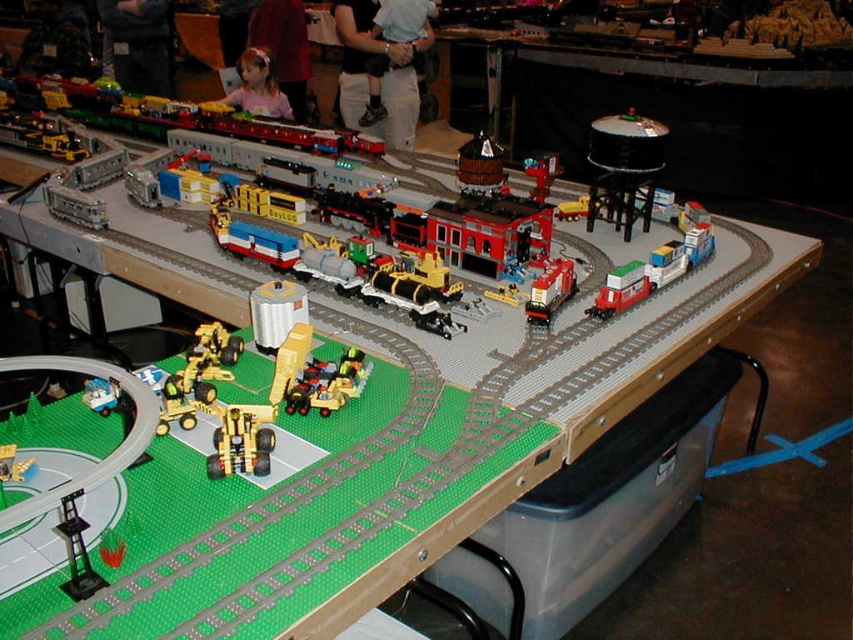
Which is more to the left, gold metallic construction vehicle at center or metallic yellow crane at lower left?

From the viewer's perspective, metallic yellow crane at lower left appears more on the left side.

Is gold metallic construction vehicle at center smaller than metallic yellow crane at lower left?

Yes, gold metallic construction vehicle at center is smaller than metallic yellow crane at lower left.

Who is more distant from viewer, (260, 420) or (91, 384)?

The point (91, 384) is behind.

Where is `gold metallic construction vehicle at center`? The width and height of the screenshot is (853, 640). gold metallic construction vehicle at center is located at coordinates (242, 442).

Which of these two, pink fabric at upper center or gold metallic construction vehicle at center, stands taller?

Standing taller between the two is pink fabric at upper center.

Which is more to the right, pink fabric at upper center or gold metallic construction vehicle at center?

gold metallic construction vehicle at center

Does point (248, 38) come closer to viewer compared to point (260, 474)?

No, (248, 38) is further to viewer.

Where is `pink fabric at upper center`? pink fabric at upper center is located at coordinates (283, 48).

Can you confirm if light blue shirt at center is smaller than shiny red plastic train at center?

Actually, light blue shirt at center might be larger than shiny red plastic train at center.

Is point (396, 17) positioned in front of point (560, 291)?

No, (396, 17) is further to viewer.

This screenshot has height=640, width=853. What do you see at coordinates (404, 22) in the screenshot?
I see `light blue shirt at center` at bounding box center [404, 22].

You are a GUI agent. You are given a task and a screenshot of the screen. Output one action in this format:
    pyautogui.click(x=<x>, y=<y>)
    Task: Click on the light blue shirt at center
    
    Given the screenshot: What is the action you would take?
    pyautogui.click(x=404, y=22)